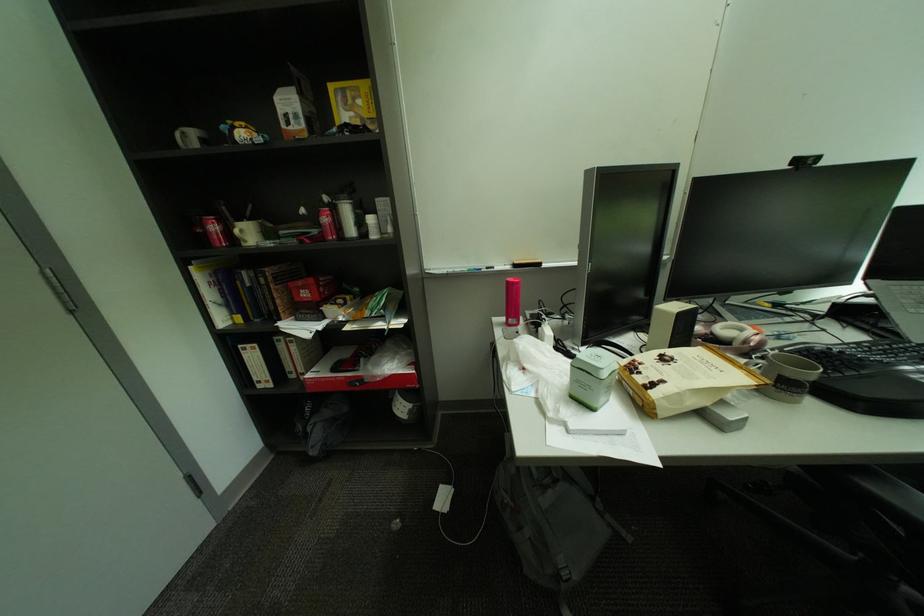
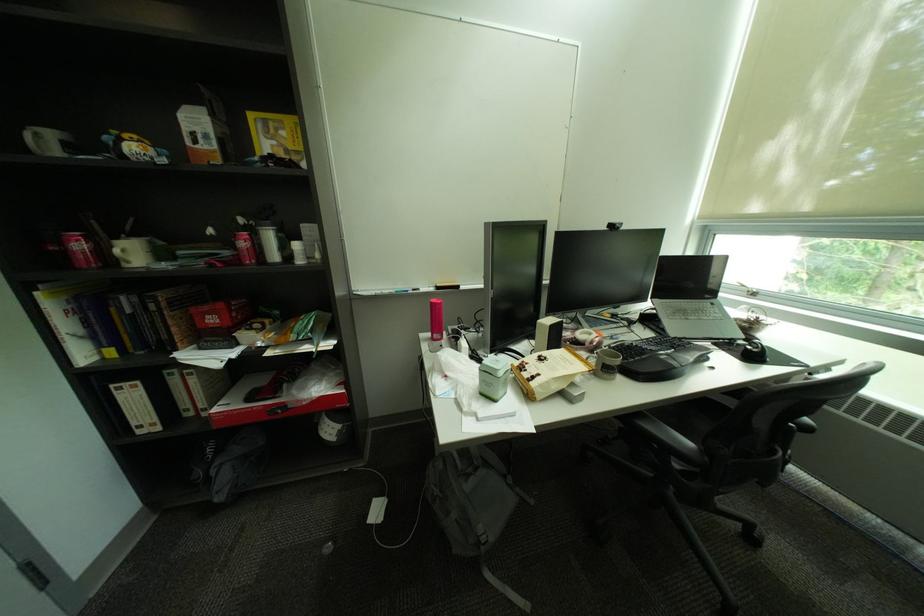
The point at (225,229) is marked in the first image. Where is the corresponding point in the second image?

(91, 246)